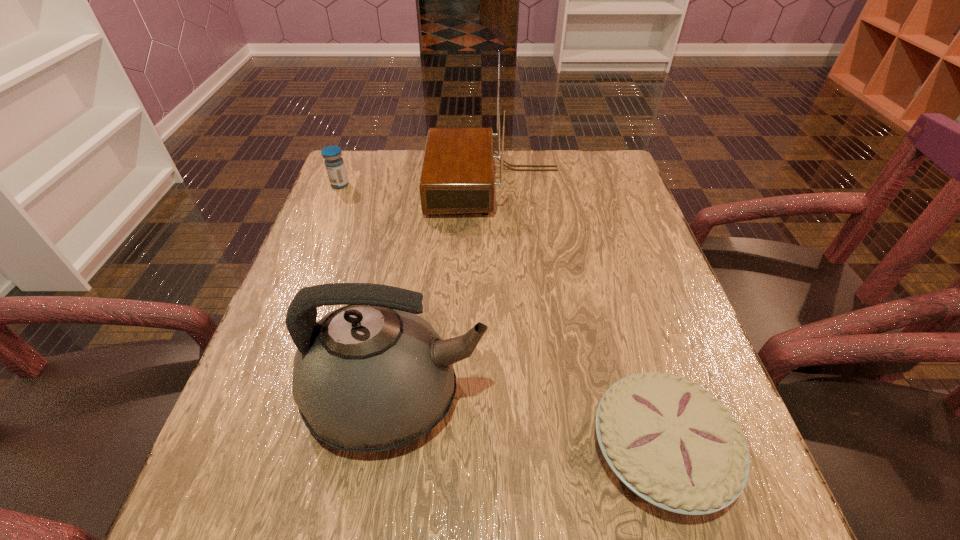
Image resolution: width=960 pixels, height=540 pixels. Find the location of `radio_receiver`. radio_receiver is located at coordinates (457, 177).

Where is `kettle`? The image size is (960, 540). kettle is located at coordinates (371, 376).

Where is `medicine`? This screenshot has width=960, height=540. medicine is located at coordinates (334, 163).

Find the location of a particular element. The height and width of the screenshot is (540, 960). the leftmost object is located at coordinates (334, 163).

Where is `pie`? This screenshot has height=540, width=960. pie is located at coordinates point(672,443).

The image size is (960, 540). In order to click on blank space located 0.120m on the front panel of the radio_receiver in this screenshot , I will do `click(385, 184)`.

Locate an element on the screen. The image size is (960, 540). vacant region located 0.160m on the front panel of the radio_receiver is located at coordinates (371, 184).

Identify the location of vacant space situated on the front panel of the radio_receiver. (363, 184).

Locate an element on the screen. This screenshot has width=960, height=540. vacant space situated 0.170m at the spout of the kettle is located at coordinates (585, 398).

This screenshot has height=540, width=960. I want to click on free space located on the front of the medicine, so click(315, 247).